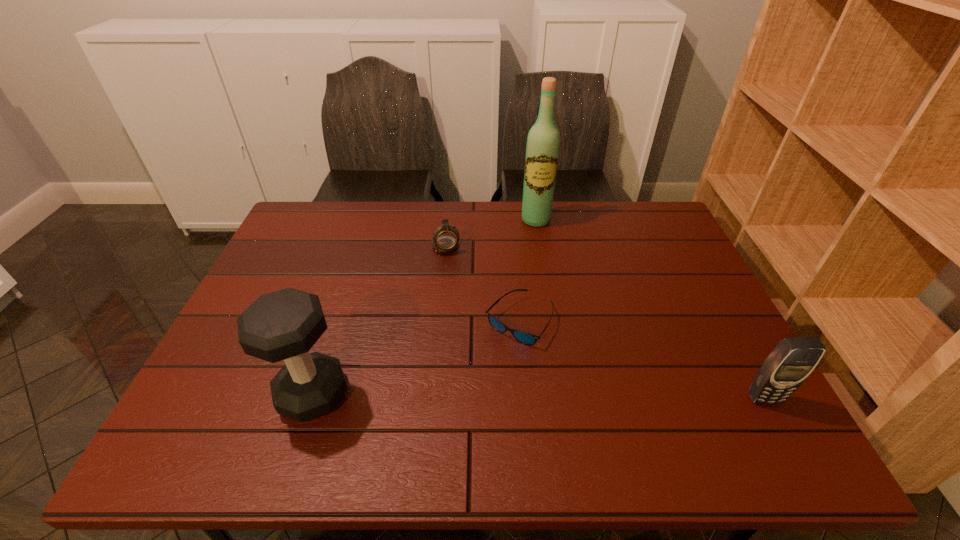
Image resolution: width=960 pixels, height=540 pixels. What are the coordinates of `vacant space that's between the fourth object from right to left and the fourth shortest object` in the screenshot? It's located at (379, 319).

Where is `free space between the third nearest object and the dumbbell`? Image resolution: width=960 pixels, height=540 pixels. free space between the third nearest object and the dumbbell is located at coordinates (416, 357).

Point out which object is positioned as the second nearest to the third nearest object. Please provide its 2D coordinates. Your answer should be formatted as a tuple, i.e. [(x, y)], where the tuple contains the x and y coordinates of a point satisfying the conditions above.

[(283, 325)]

Select which object is the fourth closest to the third shortest object. Please provide its 2D coordinates. Your answer should be formatted as a tuple, i.e. [(x, y)], where the tuple contains the x and y coordinates of a point satisfying the conditions above.

[(283, 325)]

This screenshot has height=540, width=960. I want to click on vacant region that satisfies the following two spatial constraints: 1. on the back side of the leftmost object; 2. on the left side of the farthest object, so click(x=370, y=220).

The image size is (960, 540). Identify the location of free space that satisfies the following two spatial constraints: 1. on the back side of the leftmost object; 2. on the left side of the third nearest object. (336, 321).